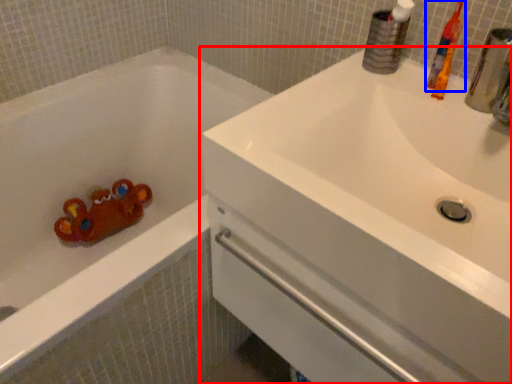
Question: Which object appears farthest to the camera in this image, sink (highlighted by a red box) or toothbrush (highlighted by a blue box)?

Choices:
 (A) sink
 (B) toothbrush

Answer: (B)